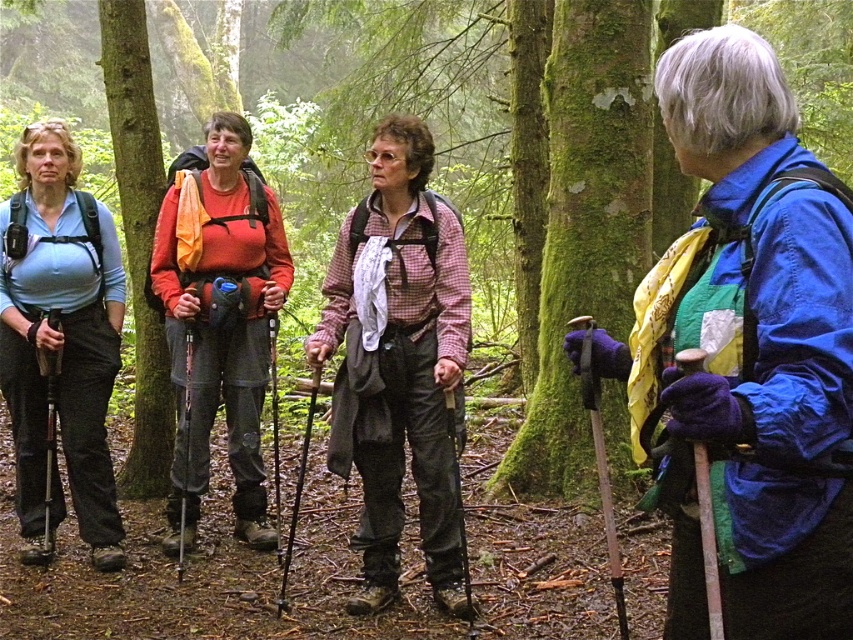
You are a hiker who wants to take a photo of both the blue fabric jacket at right and the matte blue shirt at left. Which one should you focus on first to ensure both are in the frame?

You should focus on the blue fabric jacket at right first since it is closer to the viewer than the matte blue shirt at left, ensuring both are in the frame.

You are a photographer positioned at the center of the forest scene. You want to capture a photo that includes both the matte blue shirt at left and the green mossy tree at left. Which object should you adjust your camera angle to focus on first to ensure both fit in the frame?

Since the matte blue shirt at left is wider than the green mossy tree at left, you should focus on the matte blue shirt at left first to ensure its entire width is captured in the frame before adjusting for the tree.

You are a hiker who wants to take shelter under the green mossy tree at left. Can you stand directly under the tree while also keeping the blue fabric jacket at right visible in your view?

The blue fabric jacket at right is positioned under the green mossy tree at left, so if you stand directly under the tree, the jacket would be in the shadow or obscured by the tree, making it less visible. To keep the jacket visible, you might need to position yourself where both the tree and the jacket are within your line of sight, possibly to the side or behind the tree.